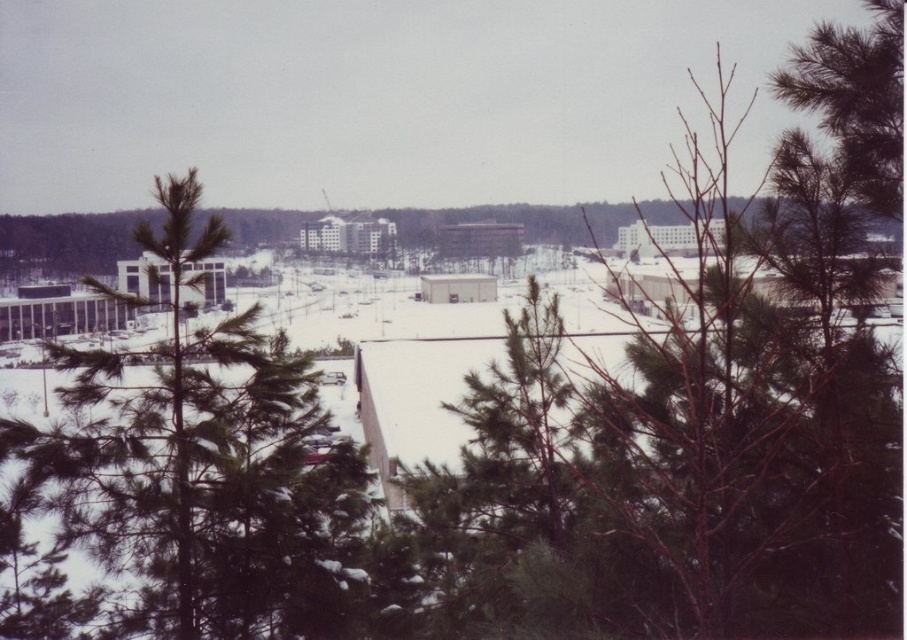
You are standing at the top of a hill overlooking a winter landscape. You notice a green leafy tree at center. Based on its position coordinates, can you determine whether the tree is closer to the top or bottom of the image?

The green leafy tree at center is located at coordinates point (689, 448), which places it closer to the bottom of the image since the y coordinate is higher.